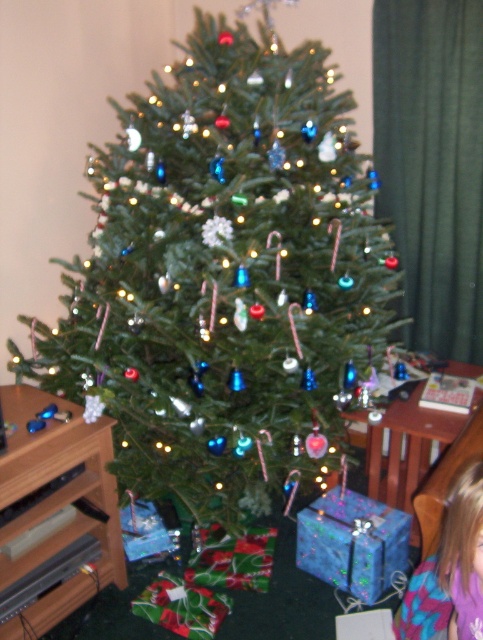
You are standing in front of the Christmas tree and see the point at coordinates point (226, 276). Which object is this point located on?

The point (226, 276) is located on the green matte christmas tree at center.

In the scene shown: You are standing in front of the Christmas tree and want to hang an ornament. There are two points marked on the tree at coordinates point (226, 454) and point (472, 564). Which point is closer to the back of the tree?

Point (226, 454) is behind point (472, 564), so the point closer to the back of the tree is point (226, 454).

You are a guest at a Christmas party and want to take a photo with the green matte christmas tree at center and the blonde hair at lower right. Which object should you stand closer to in order to include both in your camera frame?

You should stand closer to the blonde hair at lower right because the green matte christmas tree at center is larger in size, so moving closer to the smaller object allows both to fit within the camera frame.